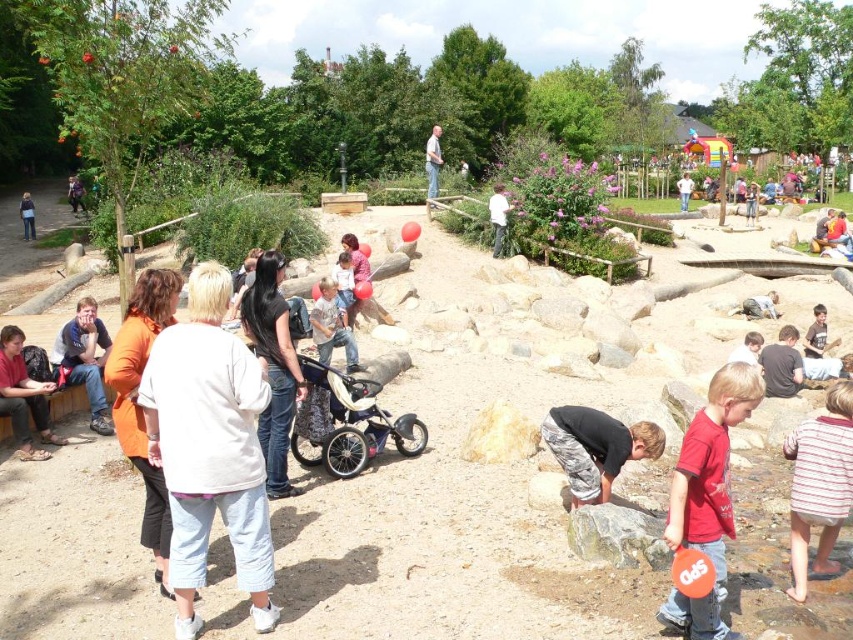
Who is positioned more to the left, matte blue shirt at left or light blue jeans at center?

Positioned to the left is matte blue shirt at left.

Based on the photo, who is positioned more to the right, matte blue shirt at left or light blue jeans at center?

light blue jeans at center

Find the location of a particular element. The image size is (853, 640). matte blue shirt at left is located at coordinates (84, 358).

Image resolution: width=853 pixels, height=640 pixels. Describe the element at coordinates (819, 483) in the screenshot. I see `striped cotton shirt at lower right` at that location.

Can you confirm if striped cotton shirt at lower right is shorter than light blue jeans at center?

Correct, striped cotton shirt at lower right is not as tall as light blue jeans at center.

The width and height of the screenshot is (853, 640). Describe the element at coordinates (819, 483) in the screenshot. I see `striped cotton shirt at lower right` at that location.

Locate an element on the screen. This screenshot has width=853, height=640. striped cotton shirt at lower right is located at coordinates (819, 483).

Can you confirm if red matte shirt at lower right is bigger than dark brown leather jacket at center?

Yes, red matte shirt at lower right is bigger than dark brown leather jacket at center.

Between point (723, 524) and point (286, 396), which one is positioned in front?

Point (723, 524) is in front.

Describe the element at coordinates (706, 497) in the screenshot. I see `red matte shirt at lower right` at that location.

Locate an element on the screen. The height and width of the screenshot is (640, 853). red matte shirt at lower right is located at coordinates (706, 497).